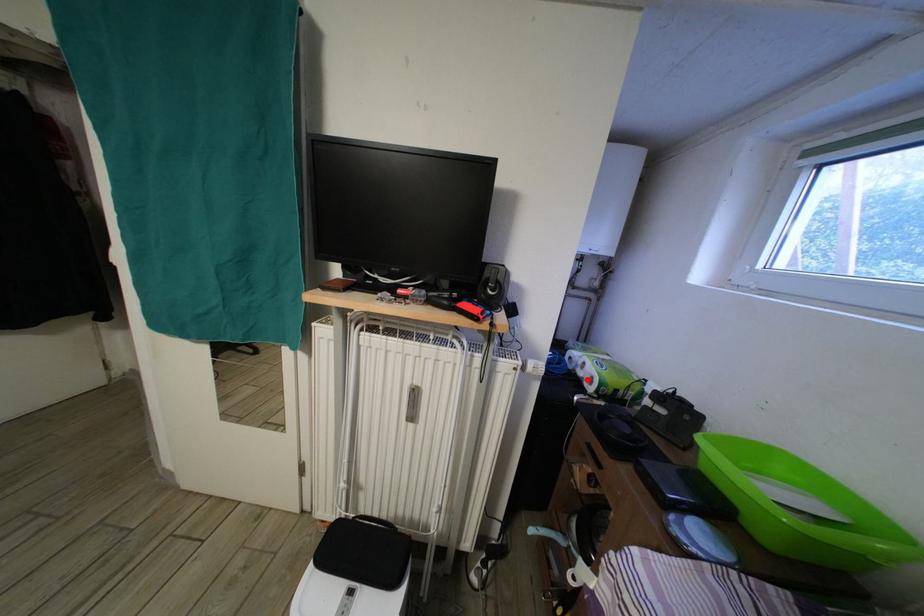
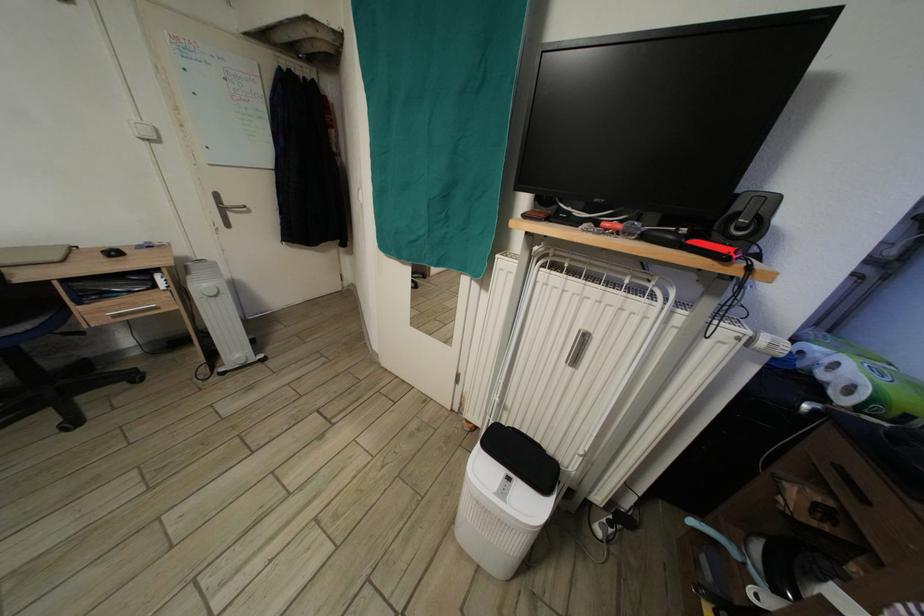
The point at the highlighted location is marked in the first image. Where is the corresponding point in the second image?

(830, 383)